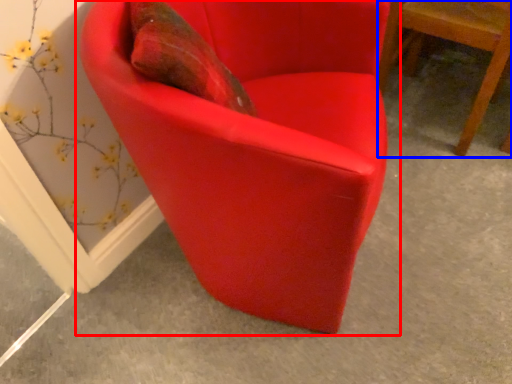
Question: Which object appears closest to the camera in this image, chair (highlighted by a red box) or chair (highlighted by a blue box)?

Choices:
 (A) chair
 (B) chair

Answer: (A)